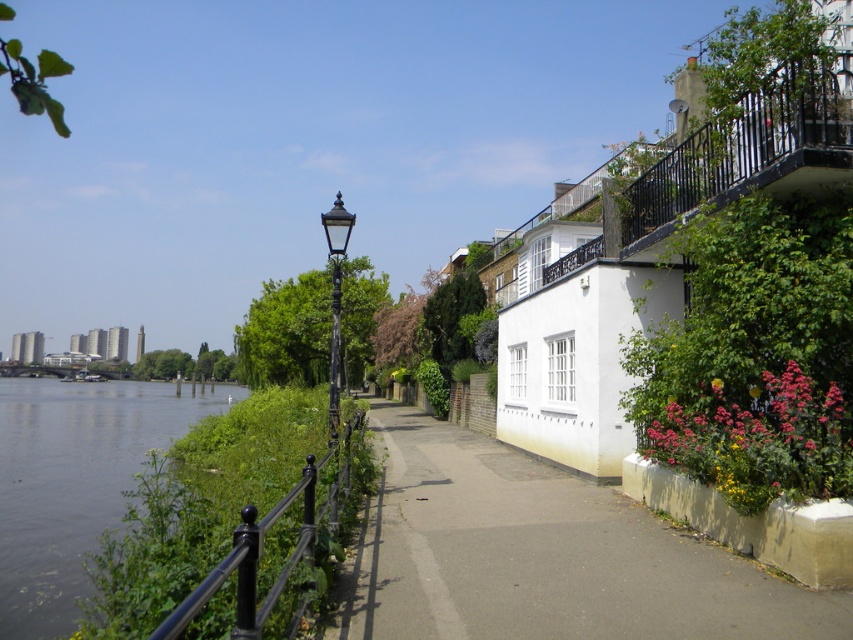
Question: Is green grassy river at left to the left of vivid pink petals at lower right from the viewer's perspective?

Choices:
 (A) yes
 (B) no

Answer: (A)

Question: Among these objects, which one is nearest to the camera?

Choices:
 (A) black metal/rail at left
 (B) smooth concrete pavement at center
 (C) vivid pink petals at lower right

Answer: (B)

Question: Observing the image, what is the correct spatial positioning of green grassy river at left in reference to black polished metal streetlight at center?

Choices:
 (A) left
 (B) right

Answer: (A)

Question: Can you confirm if green grassy river at left is smaller than white concrete wall at lower right?

Choices:
 (A) yes
 (B) no

Answer: (B)

Question: Considering the real-world distances, which object is farthest from the black polished metal streetlight at center?

Choices:
 (A) green grassy river at left
 (B) smooth concrete pavement at center

Answer: (A)

Question: Based on their relative distances, which object is farther from the smooth concrete pavement at center?

Choices:
 (A) white concrete wall at lower right
 (B) black metal/rail at left
 (C) black polished metal streetlight at center
 (D) green grassy river at left

Answer: (D)